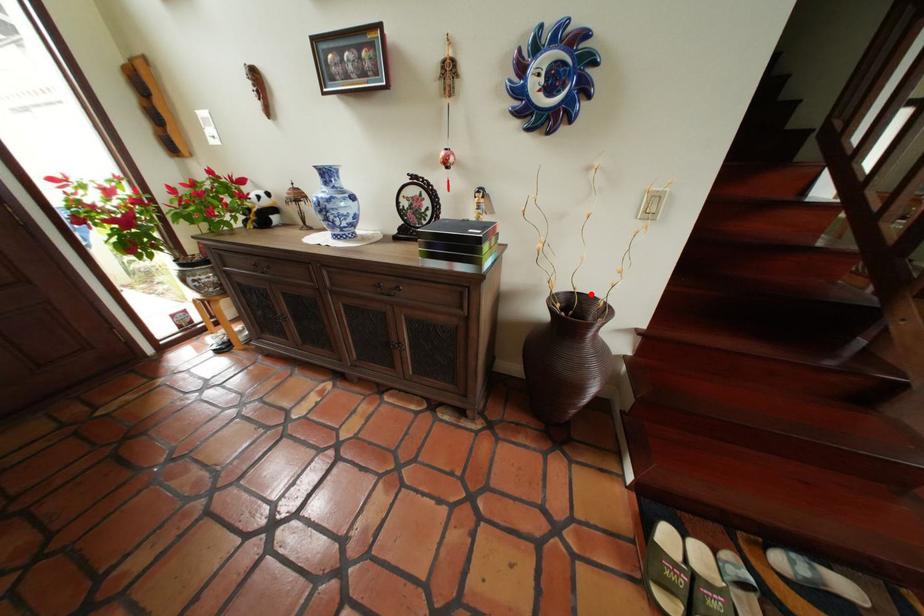
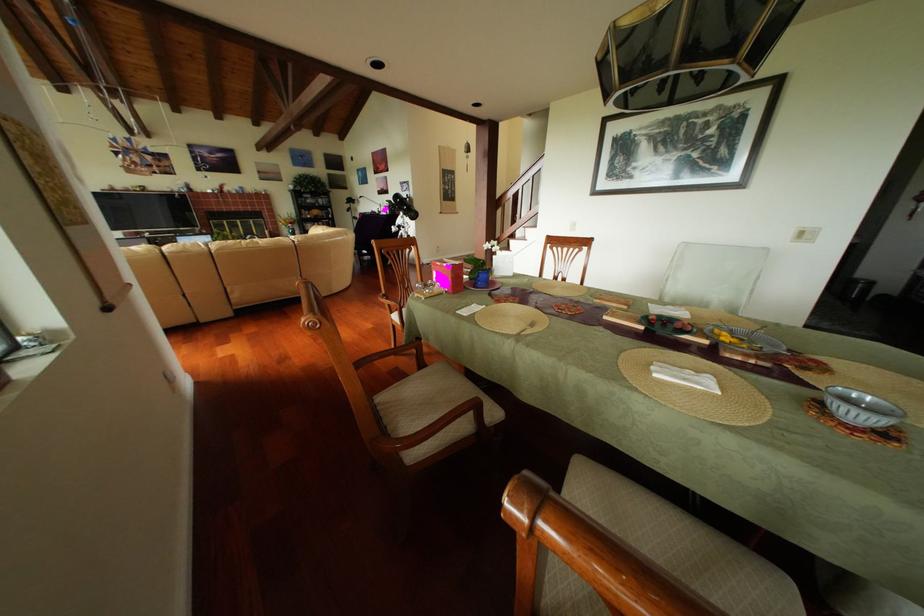
Question: I am providing you with two images of the same scene from different viewpoints. A red point is marked on the first image. Is the red point's position out of view in image 2?

Choices:
 (A) Yes
 (B) No

Answer: (A)